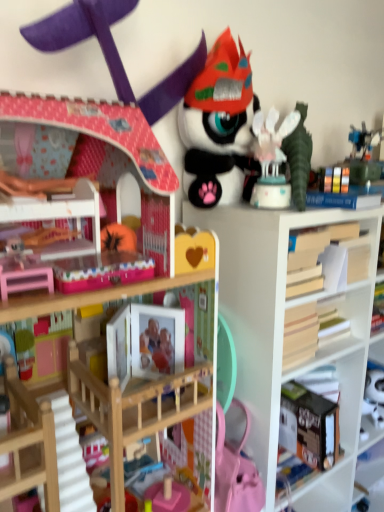
Question: Is matte black plush toy at upper center, the 2th toy viewed from the left, next to wooden book at right and touching it?

Choices:
 (A) yes
 (B) no

Answer: (B)

Question: Considering the relative sizes of matte black plush toy at upper center, the 2th toy viewed from the left, and wooden book at right in the image provided, is matte black plush toy at upper center, the 2th toy viewed from the left, thinner than wooden book at right?

Choices:
 (A) no
 (B) yes

Answer: (A)

Question: From the image's perspective, is matte black plush toy at upper center, the second toy in the right-to-left sequence, over wooden book at right?

Choices:
 (A) yes
 (B) no

Answer: (A)

Question: Can you confirm if matte black plush toy at upper center, the second toy in the right-to-left sequence, is positioned to the left of wooden book at right?

Choices:
 (A) no
 (B) yes

Answer: (B)

Question: Considering the relative sizes of matte black plush toy at upper center, the second toy in the right-to-left sequence, and wooden book at right in the image provided, is matte black plush toy at upper center, the second toy in the right-to-left sequence, smaller than wooden book at right?

Choices:
 (A) yes
 (B) no

Answer: (B)

Question: Looking at the image, does wooden book at right seem bigger or smaller compared to matte black plush toy at upper center, the 2th toy viewed from the left?

Choices:
 (A) small
 (B) big

Answer: (A)

Question: In the image, is wooden book at right positioned in front of or behind matte black plush toy at upper center, the 2th toy viewed from the left?

Choices:
 (A) front
 (B) behind

Answer: (B)

Question: Is wooden book at right situated inside matte black plush toy at upper center, the 2th toy viewed from the left, or outside?

Choices:
 (A) inside
 (B) outside

Answer: (B)

Question: Considering the positions of point (319, 260) and point (193, 94), is point (319, 260) closer or farther from the camera than point (193, 94)?

Choices:
 (A) farther
 (B) closer

Answer: (A)

Question: Is white matte bookshelf at center taller or shorter than wooden book at right?

Choices:
 (A) tall
 (B) short

Answer: (A)

Question: From the image's perspective, is white matte bookshelf at center located above or below wooden book at right?

Choices:
 (A) below
 (B) above

Answer: (A)

Question: From a real-world perspective, is white matte bookshelf at center positioned above or below wooden book at right?

Choices:
 (A) below
 (B) above

Answer: (A)

Question: Relative to wooden book at right, is white matte bookshelf at center in front or behind?

Choices:
 (A) front
 (B) behind

Answer: (A)

Question: Is wooden book at right taller or shorter than matte pink dollhouse at upper left, the first toy from the left?

Choices:
 (A) short
 (B) tall

Answer: (A)

Question: Is wooden book at right spatially inside matte pink dollhouse at upper left, the third toy when ordered from right to left, or outside of it?

Choices:
 (A) outside
 (B) inside

Answer: (A)